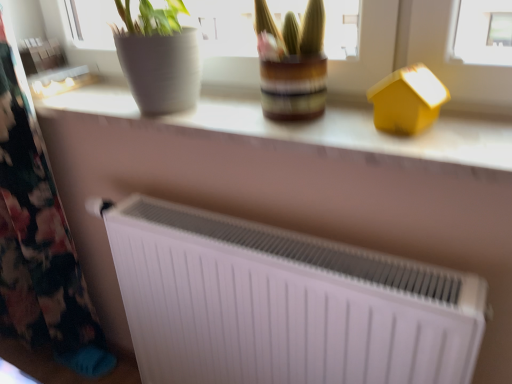
Identify the location of vacant space situated above white matte radiator at center (from a real-world perspective). Image resolution: width=512 pixels, height=384 pixels. (224, 110).